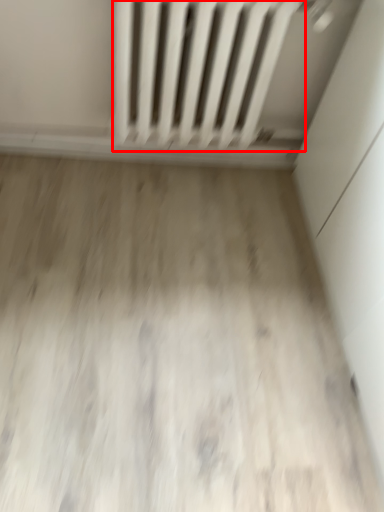
Question: From the image's perspective, what is the correct spatial positioning of radiator (annotated by the red box) in reference to plain?

Choices:
 (A) above
 (B) below

Answer: (A)